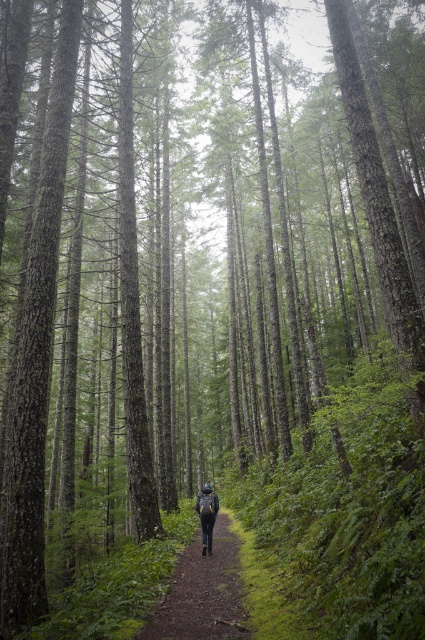
Does brown dirt path at center have a greater height compared to matte black backpack at center?

Indeed, brown dirt path at center has a greater height compared to matte black backpack at center.

Is brown dirt path at center further to the viewer compared to matte black backpack at center?

No, it is in front of matte black backpack at center.

Identify the location of brown dirt path at center. The image size is (425, 640). (203, 593).